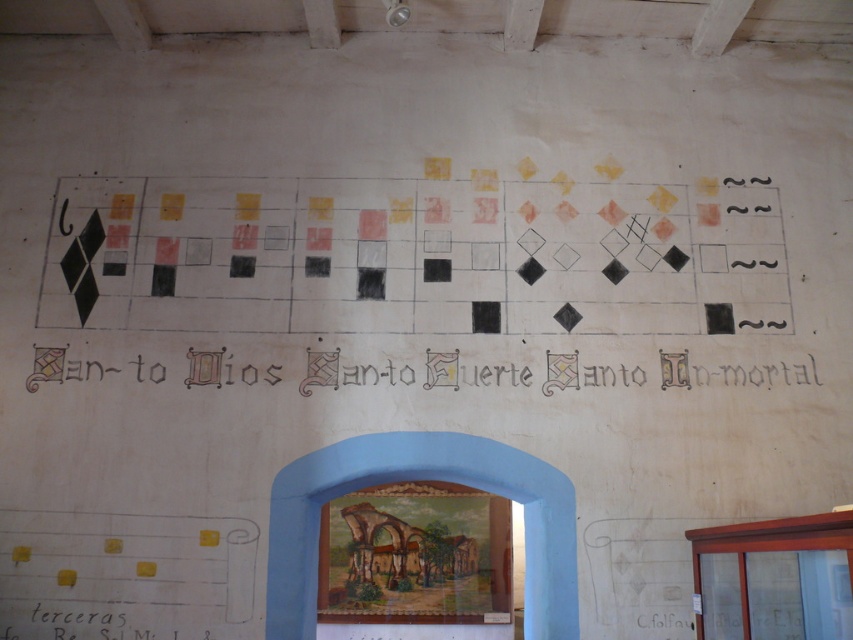
Looking at this image, can you confirm if blue painted archway at center is bigger than black calligraphy at center?

Indeed, blue painted archway at center has a larger size compared to black calligraphy at center.

The image size is (853, 640). Describe the element at coordinates (421, 480) in the screenshot. I see `blue painted archway at center` at that location.

Which is behind, point (537, 480) or point (773, 381)?

Positioned behind is point (773, 381).

At what (x,y) coordinates should I click in order to perform the action: click on blue painted archway at center. Please return your answer as a coordinate pair (x, y). This screenshot has height=640, width=853. Looking at the image, I should click on pos(421,480).

Which is in front, point (277, 376) or point (33, 632)?

Point (33, 632)

Where is `black calligraphy at center`? The height and width of the screenshot is (640, 853). black calligraphy at center is located at coordinates point(733,372).

This screenshot has height=640, width=853. I want to click on black calligraphy at center, so click(x=733, y=372).

What do you see at coordinates (421, 480) in the screenshot?
I see `blue painted archway at center` at bounding box center [421, 480].

Is point (355, 452) positioned after point (56, 630)?

Yes, point (355, 452) is behind point (56, 630).

Is point (328, 490) closer to viewer compared to point (93, 637)?

No, it is not.

You are a GUI agent. You are given a task and a screenshot of the screen. Output one action in this format:
    pyautogui.click(x=<x>, y=<y>)
    Task: Click on the blue painted archway at center
    
    Given the screenshot: What is the action you would take?
    (421, 480)